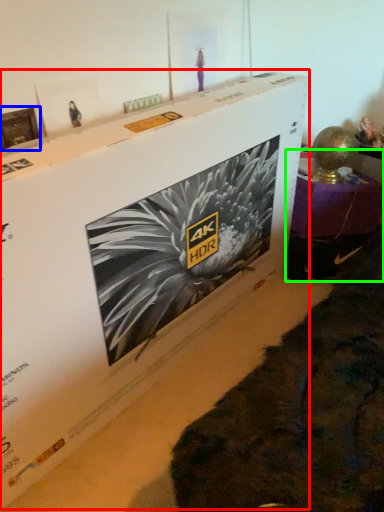
Question: Which object is the closest to the cardboard box (highlighted by a red box)? Choose among these: picture frame (highlighted by a blue box) or furniture (highlighted by a green box).

Choices:
 (A) picture frame
 (B) furniture

Answer: (A)